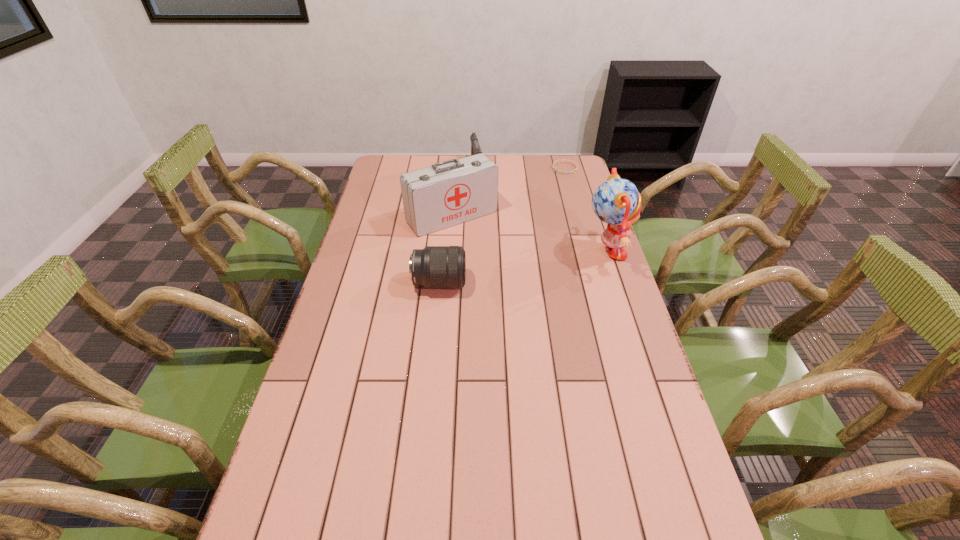
Image resolution: width=960 pixels, height=540 pixels. I want to click on telephoto lens, so click(435, 267).

Find the location of a particular element. This screenshot has height=540, width=960. doll is located at coordinates click(x=617, y=202).

Image resolution: width=960 pixels, height=540 pixels. What are the coordinates of `the first-aid kit` in the screenshot? It's located at (452, 192).

Identify the location of gun. (475, 147).

Where is `the shortest object`? the shortest object is located at coordinates 576,165.

Where is `blank space located on the surface of the telephoto lens`? This screenshot has height=540, width=960. blank space located on the surface of the telephoto lens is located at coordinates (534, 284).

At what (x,y) coordinates should I click in order to perform the action: click on vacant space located on the front-facing side of the first-aid kit. Please return your answer as a coordinate pair (x, y). The image size is (960, 540). Looking at the image, I should click on (484, 246).

At what (x,y) coordinates should I click in order to perform the action: click on blank space located 0.280m on the front-facing side of the first-aid kit. Please return your answer as a coordinate pair (x, y). Looking at the image, I should click on (516, 281).

The width and height of the screenshot is (960, 540). Identify the location of vacant space located on the front-facing side of the first-aid kit. (538, 305).

This screenshot has width=960, height=540. Identify the location of vacant region located in the direction the gun is aimed. (485, 205).